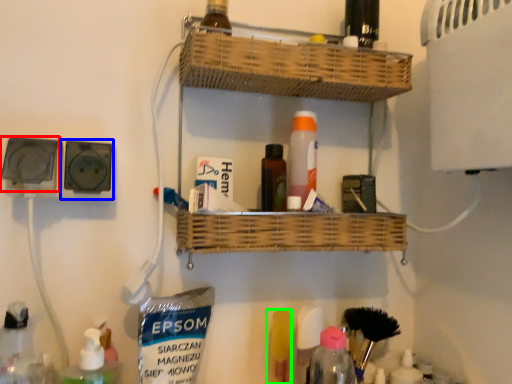
Question: Considering the real-world distances, which object is closest to electric outlet (highlighted by a red box)? electric outlet (highlighted by a blue box) or toiletry (highlighted by a green box).

Choices:
 (A) electric outlet
 (B) toiletry

Answer: (A)